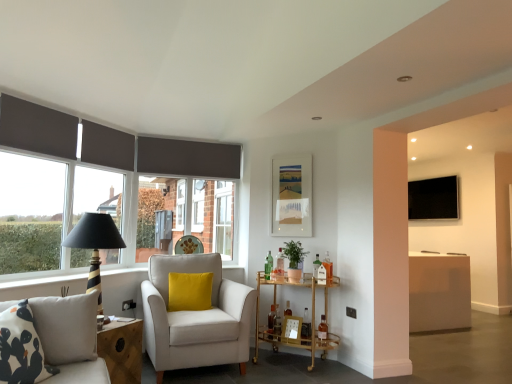
Question: Is the surface of patterned fabric studio couch at lower left in direct contact with velvet yellow pillow at center?

Choices:
 (A) no
 (B) yes

Answer: (A)

Question: Considering the relative sizes of patterned fabric studio couch at lower left and velvet yellow pillow at center in the image provided, is patterned fabric studio couch at lower left taller than velvet yellow pillow at center?

Choices:
 (A) yes
 (B) no

Answer: (A)

Question: Does patterned fabric studio couch at lower left come in front of velvet yellow pillow at center?

Choices:
 (A) no
 (B) yes

Answer: (B)

Question: Can you confirm if patterned fabric studio couch at lower left is smaller than velvet yellow pillow at center?

Choices:
 (A) yes
 (B) no

Answer: (B)

Question: Does patterned fabric studio couch at lower left lie behind velvet yellow pillow at center?

Choices:
 (A) no
 (B) yes

Answer: (A)

Question: From the image's perspective, relative to wooden picture frame at lower center, which is the first picture frame in front-to-back order, is patterned fabric studio couch at lower left above or below?

Choices:
 (A) below
 (B) above

Answer: (B)

Question: Is patterned fabric studio couch at lower left situated inside wooden picture frame at lower center, the 1th picture frame positioned from the bottom, or outside?

Choices:
 (A) inside
 (B) outside

Answer: (B)

Question: Is point (41, 321) closer or farther from the camera than point (285, 337)?

Choices:
 (A) closer
 (B) farther

Answer: (A)

Question: From a real-world perspective, is patterned fabric studio couch at lower left physically located above or below wooden picture frame at lower center, the 2th picture frame viewed from the top?

Choices:
 (A) above
 (B) below

Answer: (A)

Question: Relative to black striped table lamp at left, is matte white picture frame at upper center, arranged as the second picture frame when viewed from the front, in front or behind?

Choices:
 (A) behind
 (B) front

Answer: (A)

Question: From a real-world perspective, is matte white picture frame at upper center, the 1th picture frame when ordered from back to front, physically located above or below black striped table lamp at left?

Choices:
 (A) below
 (B) above

Answer: (B)

Question: Choose the correct answer: Is matte white picture frame at upper center, the 1th picture frame when ordered from back to front, inside black striped table lamp at left or outside it?

Choices:
 (A) inside
 (B) outside

Answer: (B)

Question: Considering the positions of point (287, 173) and point (115, 226), is point (287, 173) closer or farther from the camera than point (115, 226)?

Choices:
 (A) farther
 (B) closer

Answer: (A)

Question: In terms of height, does velvet yellow pillow at center look taller or shorter compared to gold metallic bar cart at center?

Choices:
 (A) short
 (B) tall

Answer: (A)

Question: In terms of size, does velvet yellow pillow at center appear bigger or smaller than gold metallic bar cart at center?

Choices:
 (A) big
 (B) small

Answer: (B)